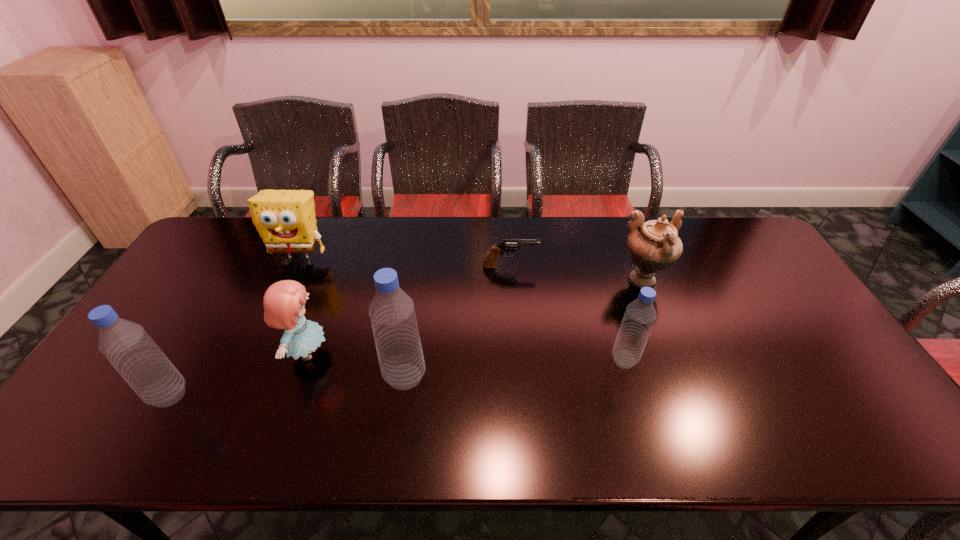
Where is `vacant area situated 0.080m on the left of the leftmost bottle`? Image resolution: width=960 pixels, height=540 pixels. vacant area situated 0.080m on the left of the leftmost bottle is located at coordinates (117, 395).

Image resolution: width=960 pixels, height=540 pixels. Identify the location of vacant area situated on the back of the second bottle from left to right. click(x=421, y=261).

You are a GUI agent. You are given a task and a screenshot of the screen. Output one action in this format:
    pyautogui.click(x=<x>, y=<y>)
    Task: Click on the vacant space located on the right of the second object from right to left
    The height and width of the screenshot is (540, 960).
    Given the screenshot: What is the action you would take?
    pyautogui.click(x=737, y=360)

At what (x,y) coordinates should I click in order to perform the action: click on vacant position located along the barrel of the shortest object. Please return your answer as a coordinate pair (x, y). Looking at the image, I should click on (655, 266).

The height and width of the screenshot is (540, 960). What are the coordinates of `vacant point located 0.280m on the face of the sponge` in the screenshot? It's located at (261, 345).

At what (x,y) coordinates should I click in order to perform the action: click on blank space located on the front-facing side of the doll. Please return your answer as a coordinate pair (x, y). Looking at the image, I should click on (450, 353).

The image size is (960, 540). What are the coordinates of `free space located on the back of the urn` in the screenshot? It's located at (625, 238).

Find the location of a particular element. object that is positioned at the far edge is located at coordinates (285, 219).

Image resolution: width=960 pixels, height=540 pixels. I want to click on doll at the near edge, so click(x=284, y=302).

Image resolution: width=960 pixels, height=540 pixels. Identify the location of object positioned at the left edge. (126, 345).